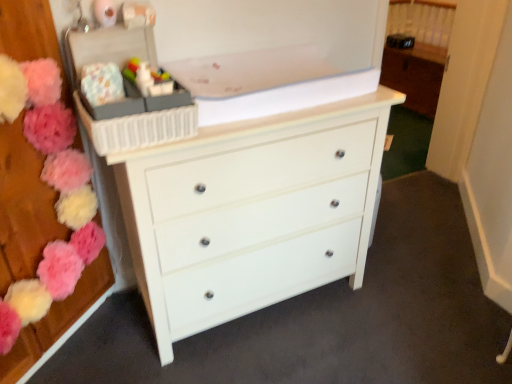
Question: Considering the relative positions of white glossy chest of drawers at center and plastic storage box at upper left in the image provided, is white glossy chest of drawers at center to the right of plastic storage box at upper left from the viewer's perspective?

Choices:
 (A) no
 (B) yes

Answer: (B)

Question: Can you confirm if white glossy chest of drawers at center is thinner than plastic storage box at upper left?

Choices:
 (A) no
 (B) yes

Answer: (A)

Question: From a real-world perspective, does white glossy chest of drawers at center sit lower than plastic storage box at upper left?

Choices:
 (A) no
 (B) yes

Answer: (B)

Question: Does white glossy chest of drawers at center have a smaller size compared to plastic storage box at upper left?

Choices:
 (A) no
 (B) yes

Answer: (A)

Question: Could you tell me if white glossy chest of drawers at center is turned towards plastic storage box at upper left?

Choices:
 (A) yes
 (B) no

Answer: (B)

Question: Which is correct: white glossy cabinet at upper right is inside white glossy chest of drawers at center, or outside of it?

Choices:
 (A) inside
 (B) outside

Answer: (B)

Question: In terms of size, does white glossy cabinet at upper right appear bigger or smaller than white glossy chest of drawers at center?

Choices:
 (A) small
 (B) big

Answer: (A)

Question: From the image's perspective, relative to white glossy chest of drawers at center, is white glossy cabinet at upper right above or below?

Choices:
 (A) above
 (B) below

Answer: (A)

Question: Considering the relative positions of white glossy cabinet at upper right and white glossy chest of drawers at center in the image provided, is white glossy cabinet at upper right to the left or to the right of white glossy chest of drawers at center?

Choices:
 (A) left
 (B) right

Answer: (B)

Question: From the image's perspective, is fluffy fabric flowers at left, marked as the 2th flower in a right-to-left arrangement, located above or below plastic storage box at upper left?

Choices:
 (A) above
 (B) below

Answer: (B)

Question: Is fluffy fabric flowers at left, which appears as the first flower when viewed from the left, inside the boundaries of plastic storage box at upper left, or outside?

Choices:
 (A) outside
 (B) inside

Answer: (A)

Question: From a real-world perspective, is fluffy fabric flowers at left, marked as the 2th flower in a right-to-left arrangement, above or below plastic storage box at upper left?

Choices:
 (A) above
 (B) below

Answer: (B)

Question: Is fluffy fabric flowers at left, which appears as the first flower when viewed from the left, wider or thinner than plastic storage box at upper left?

Choices:
 (A) thin
 (B) wide

Answer: (A)

Question: Would you say white glossy chest of drawers at center is to the left or to the right of matte plastic toy at upper center in the picture?

Choices:
 (A) left
 (B) right

Answer: (B)

Question: Which is correct: white glossy chest of drawers at center is inside matte plastic toy at upper center, or outside of it?

Choices:
 (A) inside
 (B) outside

Answer: (B)